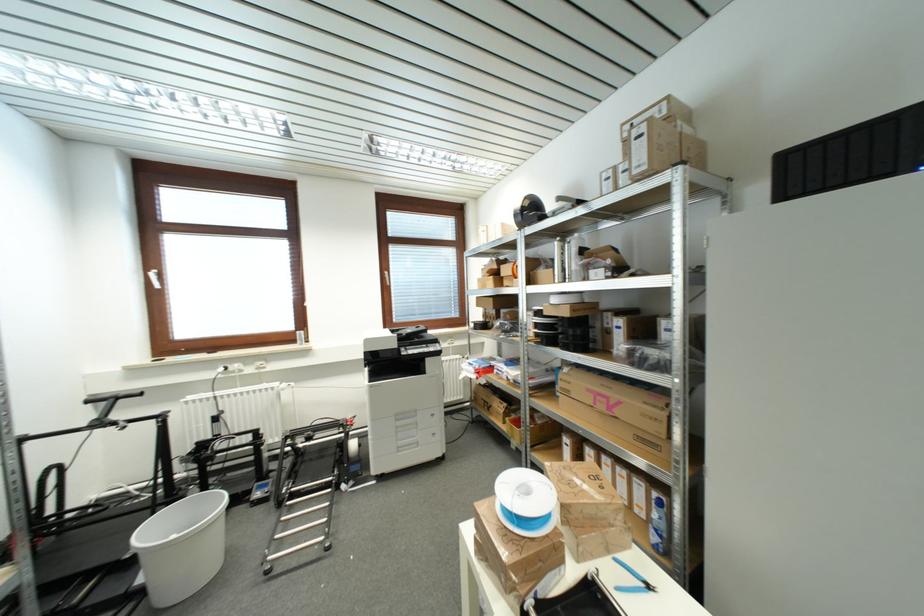
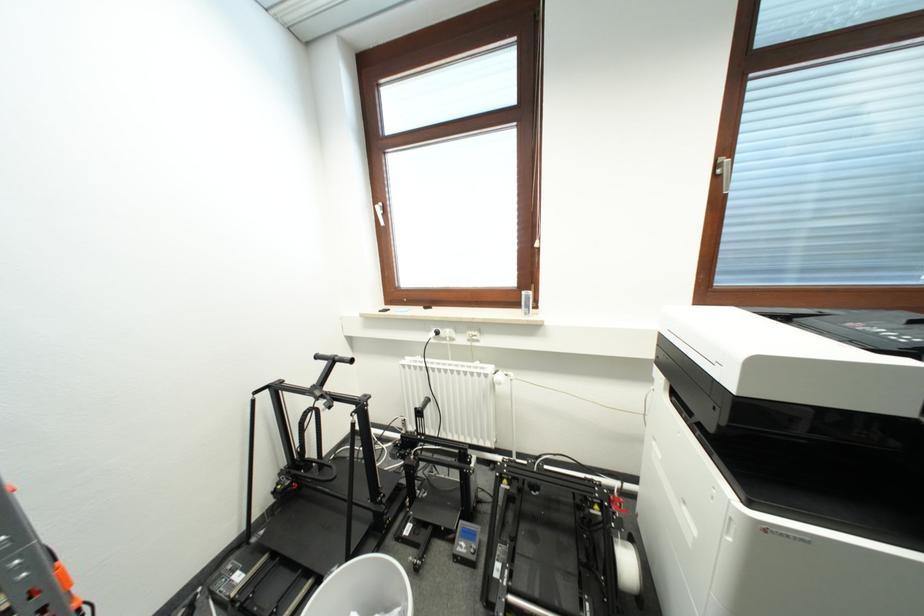
In the second image, find the point that corresponds to point (281, 387) in the first image.

(494, 371)